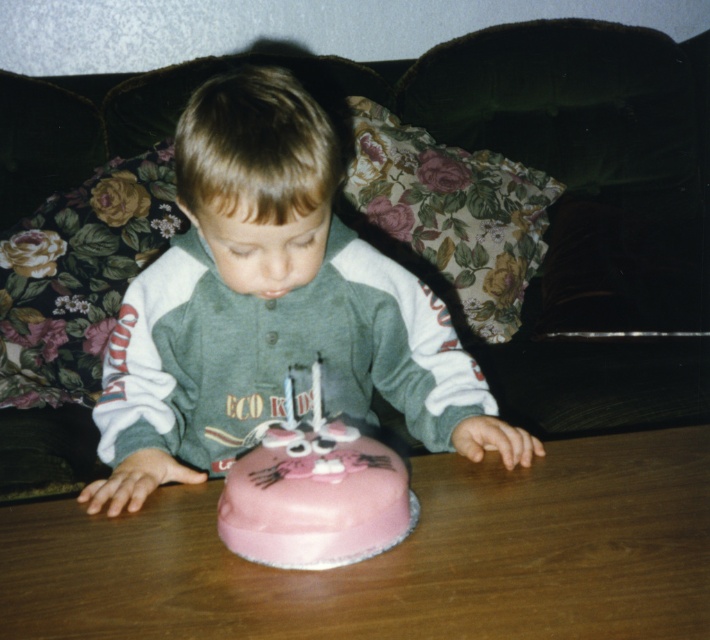
Question: Which object is closer to the camera taking this photo?

Choices:
 (A) pink matte cake at center
 (B) white paper birthday candle at center
 (C) matte green sweatshirt at center
 (D) pink frosted cake at center

Answer: (A)

Question: Which object appears farthest from the camera in this image?

Choices:
 (A) matte green sweatshirt at center
 (B) pink frosted cake at center
 (C) pink matte cake at center

Answer: (A)

Question: Is pink frosted cake at center wider than white paper birthday candle at center?

Choices:
 (A) no
 (B) yes

Answer: (B)

Question: Is matte green sweatshirt at center positioned at the back of white paper birthday candle at center?

Choices:
 (A) yes
 (B) no

Answer: (A)

Question: Can you confirm if pink matte cake at center is positioned to the left of white paper birthday candle at center?

Choices:
 (A) no
 (B) yes

Answer: (A)

Question: Which of the following is the closest to the observer?

Choices:
 (A) (403, 493)
 (B) (316, 384)
 (C) (267, 365)

Answer: (A)